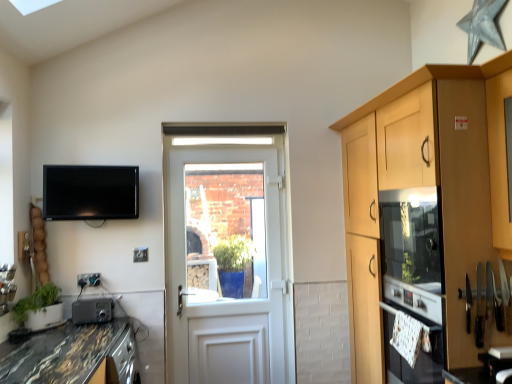
Question: From the image's perspective, is metallic gray radio at lower left above marble/black granite countertop at lower left?

Choices:
 (A) no
 (B) yes

Answer: (B)

Question: Is metallic gray radio at lower left positioned beyond the bounds of marble/black granite countertop at lower left?

Choices:
 (A) yes
 (B) no

Answer: (A)

Question: Does metallic gray radio at lower left have a greater height compared to marble/black granite countertop at lower left?

Choices:
 (A) no
 (B) yes

Answer: (A)

Question: Is metallic gray radio at lower left next to marble/black granite countertop at lower left and touching it?

Choices:
 (A) yes
 (B) no

Answer: (B)

Question: Does metallic gray radio at lower left have a lesser height compared to marble/black granite countertop at lower left?

Choices:
 (A) no
 (B) yes

Answer: (B)

Question: Is metallic gray radio at lower left to the left of marble/black granite countertop at lower left from the viewer's perspective?

Choices:
 (A) yes
 (B) no

Answer: (A)

Question: Can you confirm if green matte plant at lower left is shorter than matte wood oven at right?

Choices:
 (A) yes
 (B) no

Answer: (A)

Question: Does green matte plant at lower left have a greater height compared to matte wood oven at right?

Choices:
 (A) no
 (B) yes

Answer: (A)

Question: From the image's perspective, is green matte plant at lower left above matte wood oven at right?

Choices:
 (A) yes
 (B) no

Answer: (B)

Question: From a real-world perspective, is green matte plant at lower left beneath matte wood oven at right?

Choices:
 (A) yes
 (B) no

Answer: (A)

Question: Could you tell me if green matte plant at lower left is turned towards matte wood oven at right?

Choices:
 (A) no
 (B) yes

Answer: (A)

Question: Is green matte plant at lower left wider than matte wood oven at right?

Choices:
 (A) no
 (B) yes

Answer: (A)

Question: Is matte wood oven at right positioned far away from marble/black granite countertop at lower left?

Choices:
 (A) no
 (B) yes

Answer: (B)